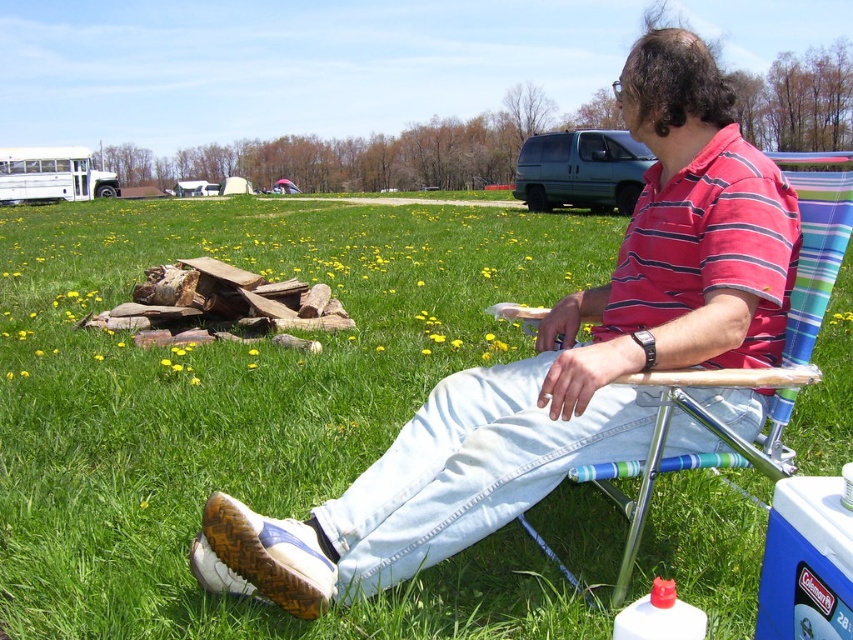
Who is positioned more to the right, striped cotton shirt at center or striped fabric chair at right?

Positioned to the right is striped fabric chair at right.

From the picture: Does striped cotton shirt at center appear on the left side of striped fabric chair at right?

Correct, you'll find striped cotton shirt at center to the left of striped fabric chair at right.

Describe the element at coordinates (556, 360) in the screenshot. This screenshot has width=853, height=640. I see `striped cotton shirt at center` at that location.

This screenshot has width=853, height=640. In order to click on striped cotton shirt at center in this screenshot , I will do `click(556, 360)`.